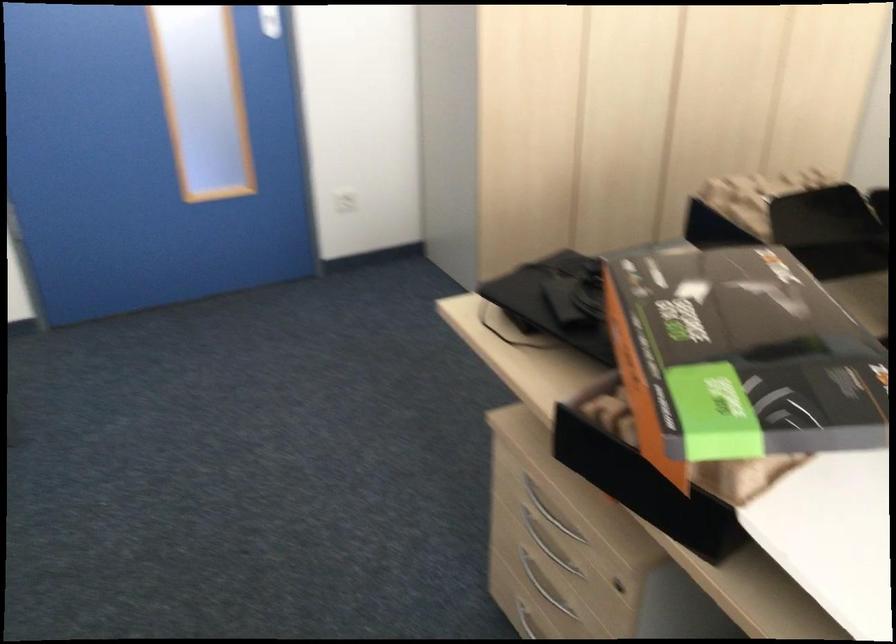
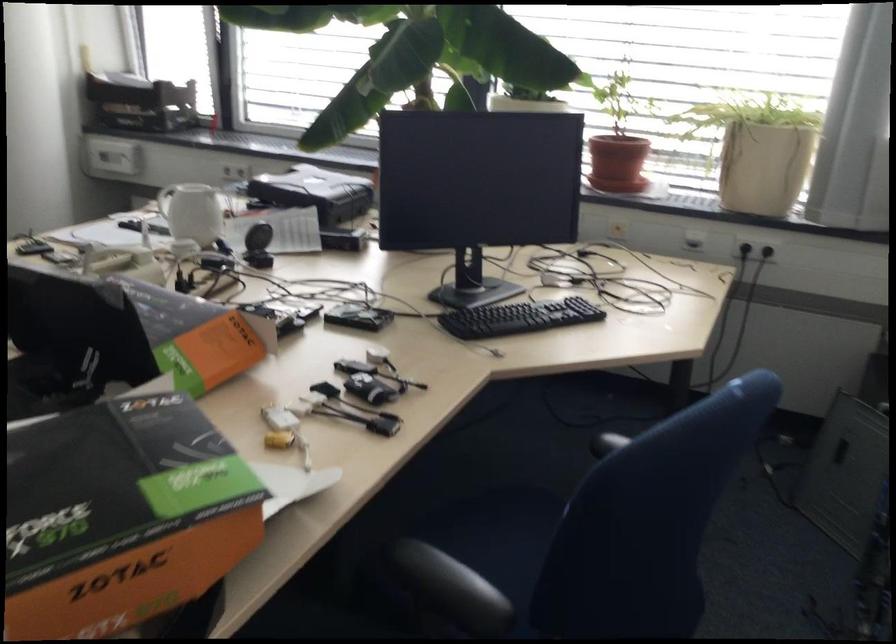
The point at (695, 391) is marked in the first image. Where is the corresponding point in the second image?

(121, 516)